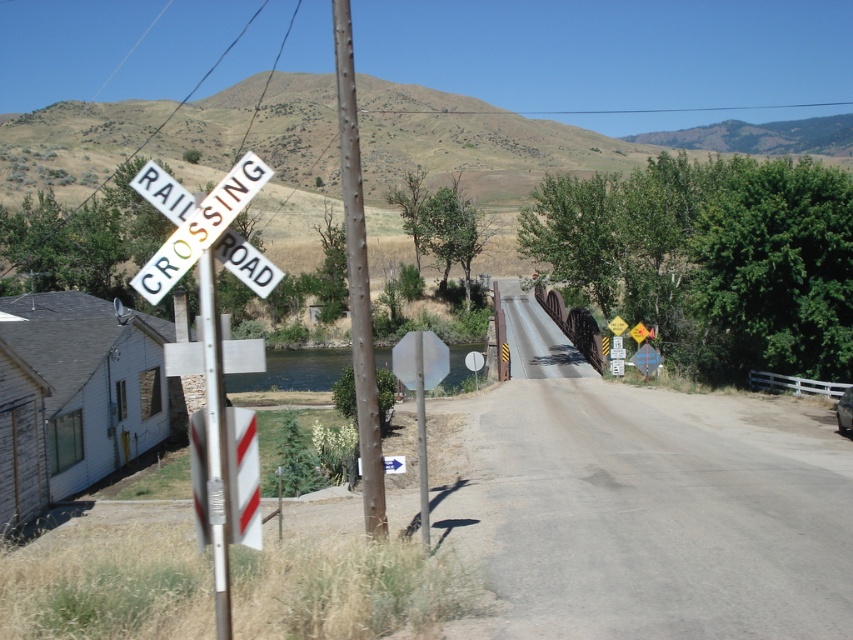
Is point (158, 288) farther from camera compared to point (218, 438)?

No, (158, 288) is closer to viewer.

Does white plastic railroad crossing sign at left appear under metallic pole at left?

No.

Measure the distance between white plastic railroad crossing sign at left and camera.

white plastic railroad crossing sign at left and camera are 4.17 meters apart from each other.

What are the coordinates of `white plastic railroad crossing sign at left` in the screenshot? It's located at (202, 228).

Who is higher up, rusty metal pole at center or metallic pole at left?

rusty metal pole at center

Which is below, rusty metal pole at center or metallic pole at left?

metallic pole at left

Find the location of `rusty metal pole at center`. rusty metal pole at center is located at coordinates (357, 276).

I want to click on rusty metal pole at center, so click(x=357, y=276).

Is rusty metal pole at center bigger than white plastic railroad crossing sign at left?

Correct, rusty metal pole at center is larger in size than white plastic railroad crossing sign at left.

Can you confirm if rusty metal pole at center is thinner than white plastic railroad crossing sign at left?

No, rusty metal pole at center is not thinner than white plastic railroad crossing sign at left.

Does point (335, 10) come farther from viewer compared to point (161, 257)?

Yes, point (335, 10) is farther from viewer.

At what (x,y) coordinates should I click in order to perform the action: click on rusty metal pole at center. Please return your answer as a coordinate pair (x, y). This screenshot has height=640, width=853. Looking at the image, I should click on (357, 276).